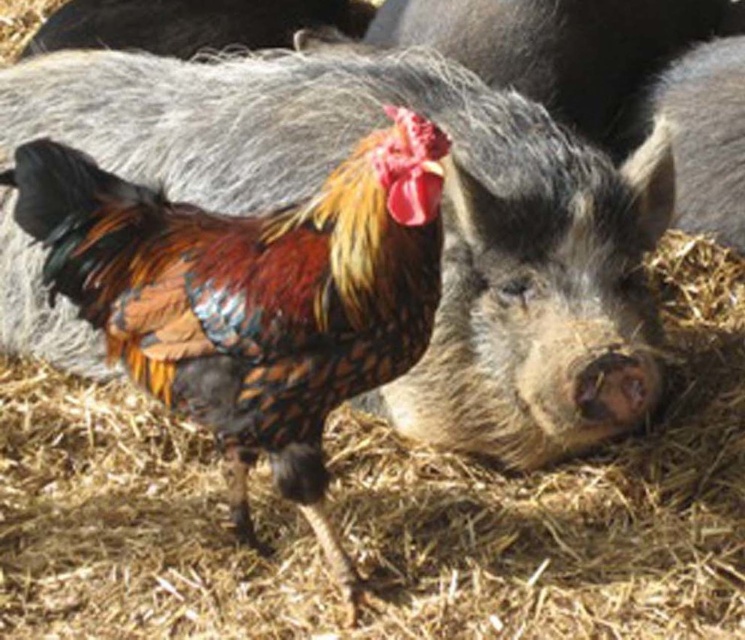
Question: Observing the image, what is the correct spatial positioning of gray fur pig at center in reference to multicolored feathered rooster at center?

Choices:
 (A) above
 (B) below

Answer: (A)

Question: Is gray fur pig at center positioned before multicolored feathered rooster at center?

Choices:
 (A) no
 (B) yes

Answer: (A)

Question: Is gray fur pig at center to the left of multicolored feathered rooster at center from the viewer's perspective?

Choices:
 (A) yes
 (B) no

Answer: (B)

Question: Which point appears farthest from the camera in this image?

Choices:
 (A) (586, 241)
 (B) (355, 288)

Answer: (A)